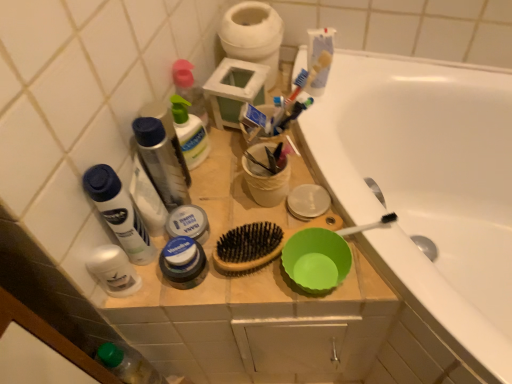
Locate an element on the screen. free spot in front of translucent plastic spray bottle at upper left, which is the first toiletry from top to bottom is located at coordinates (223, 185).